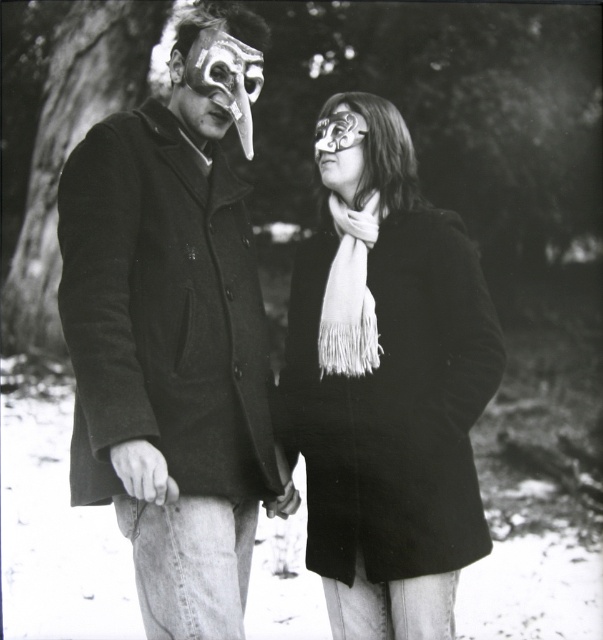
Looking at this image, which of these two, matte black mask at upper left or matte black mask at center, stands taller?

With more height is matte black mask at upper left.

Can you confirm if matte black mask at upper left is positioned to the right of matte black mask at center?

Incorrect, matte black mask at upper left is not on the right side of matte black mask at center.

Is point (241, 108) behind point (321, 156)?

No, (241, 108) is closer to viewer.

Where is `matte black mask at upper left`? The width and height of the screenshot is (603, 640). matte black mask at upper left is located at coordinates (226, 77).

Looking at this image, is matte black coat at left wider than matte black mask at upper left?

Yes, matte black coat at left is wider than matte black mask at upper left.

Who is more forward, [103,221] or [204,84]?

Positioned in front is point [103,221].

The width and height of the screenshot is (603, 640). Identify the location of matte black coat at left. (171, 346).

You are a GUI agent. You are given a task and a screenshot of the screen. Output one action in this format:
    pyautogui.click(x=<x>, y=<y>)
    Task: Click on the matte black coat at left
    This screenshot has height=640, width=603.
    Given the screenshot: What is the action you would take?
    pyautogui.click(x=171, y=346)

Does matte black coat at left have a lesser width compared to white fringed scarf at center?

No.

Between matte black coat at left and white fringed scarf at center, which one has less height?

white fringed scarf at center is shorter.

Locate an element on the screen. The width and height of the screenshot is (603, 640). matte black coat at left is located at coordinates (171, 346).